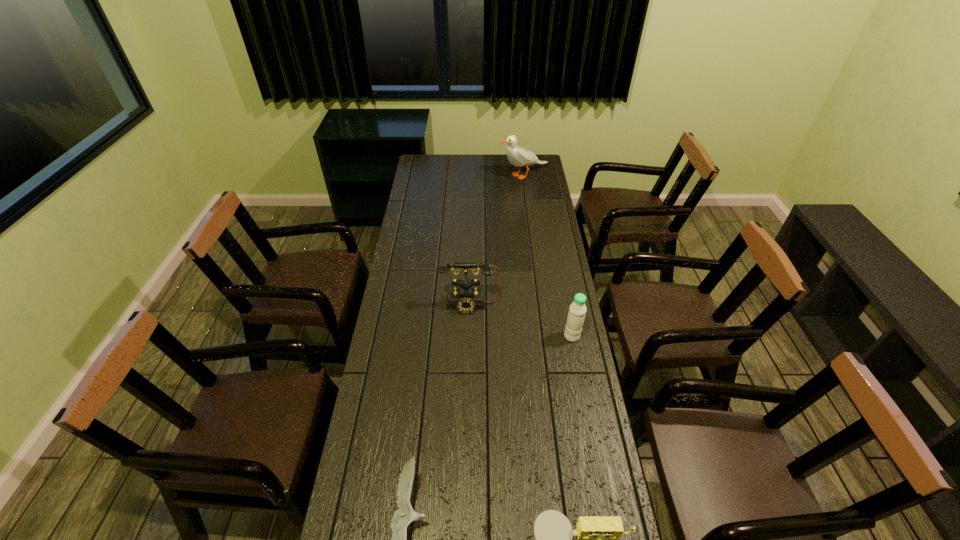
Identify which object is the third closest to the left gull. Please provide its 2D coordinates. Your answer should be formatted as a tuple, i.e. [(x, y)], where the tuple contains the x and y coordinates of a point satisfying the conditions above.

[(577, 310)]

Where is `vacant space that satisfies the following two spatial constraints: 1. at the beak of the right gull; 2. on the dial of the telephone`? The width and height of the screenshot is (960, 540). vacant space that satisfies the following two spatial constraints: 1. at the beak of the right gull; 2. on the dial of the telephone is located at coordinates (541, 305).

The height and width of the screenshot is (540, 960). In order to click on vacant region that satisfies the following two spatial constraints: 1. on the dial of the fourth nearest object; 2. on the right side of the water bottle in this screenshot , I will do `click(469, 336)`.

Where is `free space that satisfies the following two spatial constraints: 1. at the beak of the water bottle; 2. on the right side of the right gull`? This screenshot has width=960, height=540. free space that satisfies the following two spatial constraints: 1. at the beak of the water bottle; 2. on the right side of the right gull is located at coordinates (545, 336).